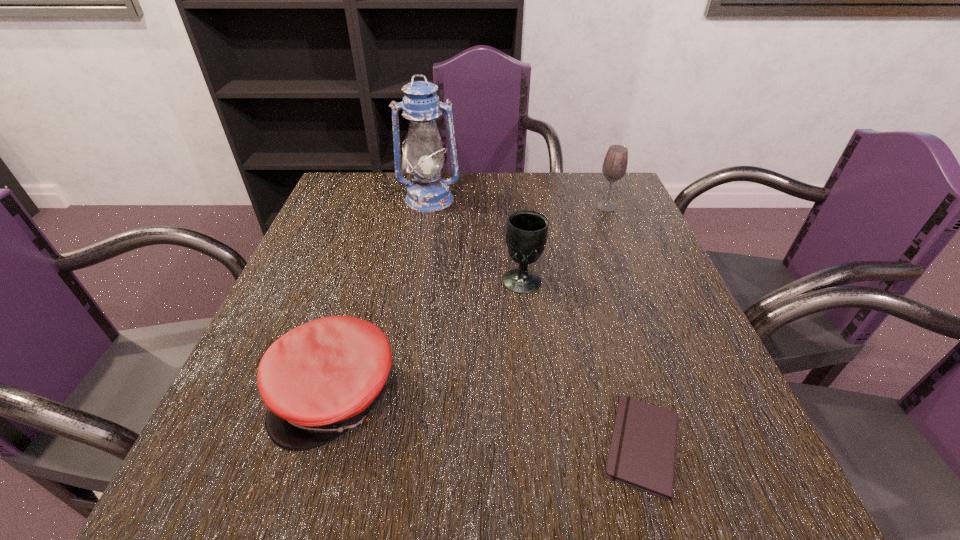
What are the coordinates of `free region located 0.290m on the left of the checkbook` in the screenshot? It's located at (408, 446).

The width and height of the screenshot is (960, 540). Identify the location of lantern that is at the far edge. click(x=428, y=192).

You are a GUI agent. You are given a task and a screenshot of the screen. Output one action in this format:
    pyautogui.click(x=<x>, y=<y>)
    Task: Click on the glass drink container at the far edge
    The height and width of the screenshot is (540, 960).
    Given the screenshot: What is the action you would take?
    pyautogui.click(x=614, y=167)

This screenshot has height=540, width=960. Find the location of `object at the near edge`. object at the near edge is located at coordinates (642, 454).

Where is `object present at the left edge`? This screenshot has height=540, width=960. object present at the left edge is located at coordinates (322, 378).

The height and width of the screenshot is (540, 960). I want to click on glass drink container present at the right edge, so click(614, 167).

The image size is (960, 540). What are the coordinates of `checkbook present at the right edge` in the screenshot? It's located at [642, 454].

Image resolution: width=960 pixels, height=540 pixels. Identify the location of object located at the far right corner. (614, 167).

The height and width of the screenshot is (540, 960). I want to click on object situated at the near right corner, so click(642, 454).

Locate an element on the screen. free region at the far edge of the desktop is located at coordinates (479, 190).